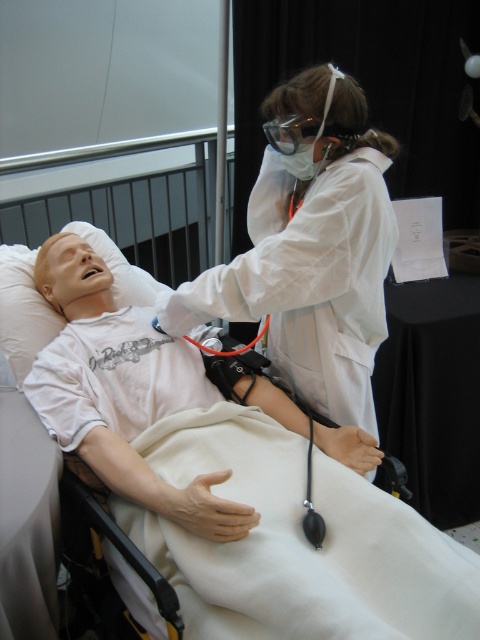
Question: Which point is farther to the camera?

Choices:
 (A) transparent plastic goggles at upper center
 (B) white matte lab coat at upper center

Answer: (A)

Question: Which object is the closest to the transparent plastic goggles at upper center?

Choices:
 (A) white matte lab coat at upper center
 (B) white matte mannequin at center

Answer: (A)

Question: Which object is the farthest from the white matte lab coat at upper center?

Choices:
 (A) transparent plastic goggles at upper center
 (B) white matte mannequin at center

Answer: (B)

Question: Does white matte mannequin at center have a larger size compared to transparent plastic goggles at upper center?

Choices:
 (A) yes
 (B) no

Answer: (A)

Question: Considering the relative positions of white matte lab coat at upper center and transparent plastic goggles at upper center in the image provided, where is white matte lab coat at upper center located with respect to transparent plastic goggles at upper center?

Choices:
 (A) above
 (B) below

Answer: (B)

Question: Can you confirm if white matte lab coat at upper center is wider than transparent plastic goggles at upper center?

Choices:
 (A) yes
 (B) no

Answer: (A)